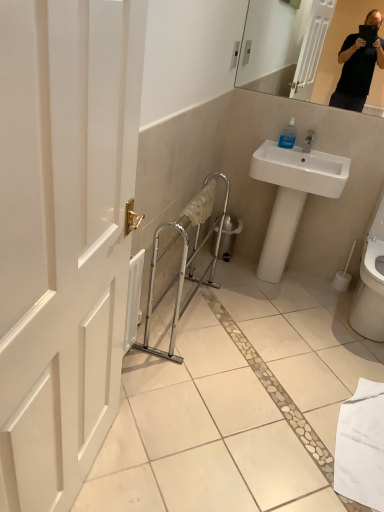
In order to face white glossy toilet at lower right, should I rotate leftwards or rightwards?

Turn right approximately 24.879 degrees to face it.

This screenshot has height=512, width=384. What are the coordinates of `white glossy sink at upper right` in the screenshot? It's located at (292, 195).

Locate an element on the screen. transparent plastic soap dispenser at upper right is located at coordinates (288, 135).

Based on the photo, what is the approximate width of transparent plastic soap dispenser at upper right?

The width of transparent plastic soap dispenser at upper right is 3.47 inches.

Where is `silver metallic balustrade at center`? Image resolution: width=384 pixels, height=512 pixels. silver metallic balustrade at center is located at coordinates (185, 258).

Is white glossy sink at upper right touching white matte toilet paper at lower right?

No, white glossy sink at upper right is not touching white matte toilet paper at lower right.

Could you tell me if white glossy sink at upper right is facing white matte toilet paper at lower right?

No, white glossy sink at upper right is not facing towards white matte toilet paper at lower right.

Can you tell me how much silver metallic balustrade at center and white glossy toilet at lower right differ in facing direction?

The angular difference between silver metallic balustrade at center and white glossy toilet at lower right is 92.3 degrees.

Which of these two, silver metallic balustrade at center or white glossy toilet at lower right, is smaller?

white glossy toilet at lower right is smaller.

From a real-world perspective, is silver metallic balustrade at center below white glossy toilet at lower right?

Correct, in the physical world, silver metallic balustrade at center is lower than white glossy toilet at lower right.

Is silver metallic balustrade at center further to the viewer compared to white glossy toilet at lower right?

No, it is in front of white glossy toilet at lower right.

From a real-world perspective, relative to transparent plastic soap dispenser at upper right, is silver metallic balustrade at center vertically above or below?

silver metallic balustrade at center is situated lower than transparent plastic soap dispenser at upper right in the real world.

From the image's perspective, which one is positioned higher, silver metallic balustrade at center or transparent plastic soap dispenser at upper right?

transparent plastic soap dispenser at upper right is shown above in the image.

Consider the image. Does silver metallic balustrade at center have a larger size compared to transparent plastic soap dispenser at upper right?

Correct, silver metallic balustrade at center is larger in size than transparent plastic soap dispenser at upper right.

Is silver metallic balustrade at center far from transparent plastic soap dispenser at upper right?

Actually, silver metallic balustrade at center and transparent plastic soap dispenser at upper right are a little close together.

How many degrees apart are the facing directions of white matte toilet paper at lower right and silver metallic balustrade at center?

The angular difference between white matte toilet paper at lower right and silver metallic balustrade at center is 92.3 degrees.

Would you say white matte toilet paper at lower right is a long distance from silver metallic balustrade at center?

Indeed, white matte toilet paper at lower right is not near silver metallic balustrade at center.

Does white matte toilet paper at lower right lie in front of silver metallic balustrade at center?

No, it is not.

From a real-world perspective, is white matte toilet paper at lower right positioned above or below silver metallic balustrade at center?

white matte toilet paper at lower right is situated lower than silver metallic balustrade at center in the real world.

Are white glossy toilet at lower right and white glossy sink at upper right far apart?

That's not correct — white glossy toilet at lower right is a little close to white glossy sink at upper right.

Does white glossy toilet at lower right come in front of white glossy sink at upper right?

Yes, white glossy toilet at lower right is closer to the viewer.

Considering the sizes of white glossy toilet at lower right and white glossy sink at upper right in the image, is white glossy toilet at lower right wider or thinner than white glossy sink at upper right?

Clearly, white glossy toilet at lower right has more width compared to white glossy sink at upper right.

Identify the location of sink behind the white glossy toilet at lower right. (292, 195).

Are white glossy sink at upper right and silver metallic balustrade at center beside each other?

No.

Is white glossy sink at upper right behind silver metallic balustrade at center?

Yes, white glossy sink at upper right is behind silver metallic balustrade at center.

Is white glossy sink at upper right facing towards silver metallic balustrade at center?

Yes, white glossy sink at upper right is oriented towards silver metallic balustrade at center.

Does white glossy sink at upper right lie in front of white glossy toilet at lower right?

No.

Does point (327, 155) appear closer or farther from the camera than point (355, 323)?

Point (327, 155) is farther from the camera than point (355, 323).

Is white glossy sink at upper right beside white glossy toilet at lower right?

white glossy sink at upper right and white glossy toilet at lower right are not in contact.

Where is `toilet paper behind the white glossy sink at upper right`? toilet paper behind the white glossy sink at upper right is located at coordinates (343, 275).

The width and height of the screenshot is (384, 512). Identify the location of toilet above the silver metallic balustrade at center (from a real-world perspective). (371, 282).

From the picture: When comparing their distances from silver metallic balustrade at center, does white glossy sink at upper right or white matte toilet paper at lower right seem further?

Among the two, white matte toilet paper at lower right is located further to silver metallic balustrade at center.

From the picture: From the image, which object appears to be farther from white matte toilet paper at lower right, white glossy toilet at lower right or silver metallic balustrade at center?

silver metallic balustrade at center is positioned further to the anchor white matte toilet paper at lower right.

From the image, which object appears to be farther from white glossy sink at upper right, silver metallic balustrade at center or transparent plastic soap dispenser at upper right?

silver metallic balustrade at center.

When comparing their distances from white glossy sink at upper right, does white matte toilet paper at lower right or silver metallic balustrade at center seem further?

Among the two, white matte toilet paper at lower right is located further to white glossy sink at upper right.

When comparing their distances from transparent plastic soap dispenser at upper right, does white glossy sink at upper right or white matte toilet paper at lower right seem closer?

white glossy sink at upper right is positioned closer to the anchor transparent plastic soap dispenser at upper right.

Considering their positions, is white glossy sink at upper right positioned closer to white glossy toilet at lower right than white matte toilet paper at lower right?

Among the two, white matte toilet paper at lower right is located nearer to white glossy toilet at lower right.

Considering their positions, is white glossy toilet at lower right positioned closer to silver metallic balustrade at center than white glossy sink at upper right?

white glossy sink at upper right.

Based on the photo, from the image, which object appears to be nearer to white glossy toilet at lower right, white matte toilet paper at lower right or transparent plastic soap dispenser at upper right?

Based on the image, white matte toilet paper at lower right appears to be nearer to white glossy toilet at lower right.

Where is `sink between transparent plastic soap dispenser at upper right and white matte toilet paper at lower right in the up-down direction`? The width and height of the screenshot is (384, 512). sink between transparent plastic soap dispenser at upper right and white matte toilet paper at lower right in the up-down direction is located at coordinates (292, 195).

Image resolution: width=384 pixels, height=512 pixels. In order to click on sink positioned between white glossy toilet at lower right and white matte toilet paper at lower right from near to far in this screenshot , I will do `click(292, 195)`.

Where is `toilet between transparent plastic soap dispenser at upper right and white matte toilet paper at lower right in the vertical direction`? toilet between transparent plastic soap dispenser at upper right and white matte toilet paper at lower right in the vertical direction is located at coordinates (371, 282).

Image resolution: width=384 pixels, height=512 pixels. I want to click on toilet paper located between silver metallic balustrade at center and white glossy toilet at lower right in the left-right direction, so click(x=343, y=275).